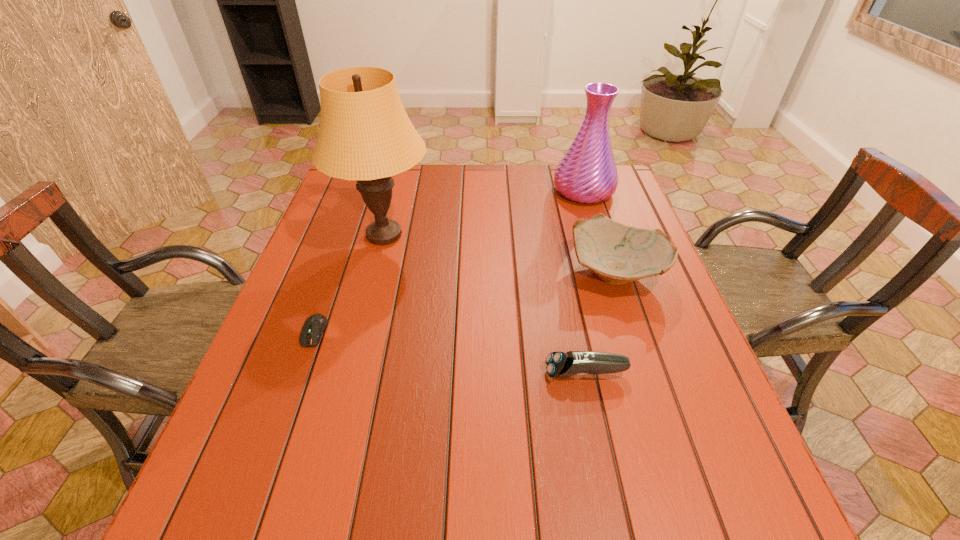
Where is `unoccupied area between the fourth farthest object and the third tallest object`? unoccupied area between the fourth farthest object and the third tallest object is located at coordinates (466, 301).

At what (x,y) coordinates should I click in order to perform the action: click on free space between the tallest object and the third shortest object. Please return your answer as a coordinate pair (x, y). The width and height of the screenshot is (960, 540). Looking at the image, I should click on [x=500, y=252].

This screenshot has width=960, height=540. What are the coordinates of `empty space between the lampshade and the electric shaver` in the screenshot? It's located at (485, 304).

Where is `free space between the third tallest object and the lampshade`? The width and height of the screenshot is (960, 540). free space between the third tallest object and the lampshade is located at coordinates (500, 252).

Where is `object that is the third closest to the fourth tallest object`? This screenshot has height=540, width=960. object that is the third closest to the fourth tallest object is located at coordinates (314, 326).

At what (x,y) coordinates should I click in order to perform the action: click on object that stands as the closest to the fourth shortest object. Please return your answer as a coordinate pair (x, y). This screenshot has width=960, height=540. Looking at the image, I should click on (617, 253).